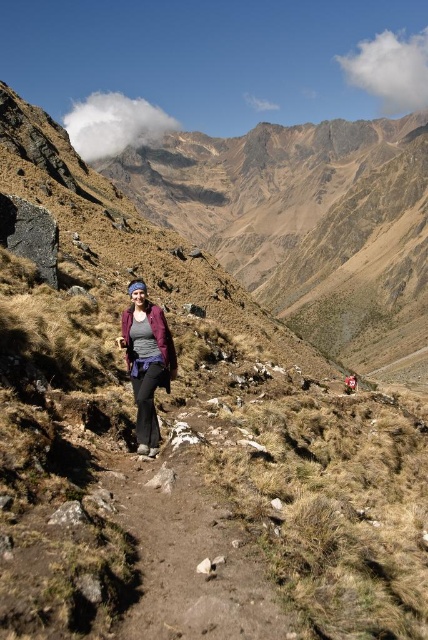
Question: Which object is positioned farthest from the brown rocky mountain at center?

Choices:
 (A) matte purple jacket at center
 (B) dirt path at center

Answer: (A)

Question: Which of the following is the farthest from the observer?

Choices:
 (A) brown rocky mountain at center
 (B) matte purple jacket at center

Answer: (A)

Question: Which object is farther from the camera taking this photo?

Choices:
 (A) matte purple jacket at center
 (B) dirt path at center

Answer: (A)

Question: Is brown rocky mountain at center thinner than matte purple jacket at center?

Choices:
 (A) no
 (B) yes

Answer: (A)

Question: Can you confirm if brown rocky mountain at center is positioned to the right of dirt path at center?

Choices:
 (A) yes
 (B) no

Answer: (A)

Question: Is brown rocky mountain at center positioned in front of dirt path at center?

Choices:
 (A) no
 (B) yes

Answer: (A)